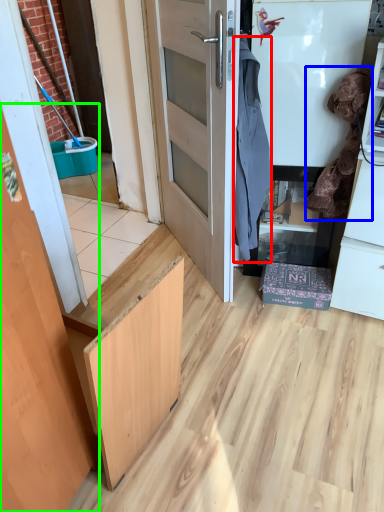
Question: Based on their relative distances, which object is farther from laundry (highlighted by a red box)? Choose from laundry (highlighted by a blue box) and door (highlighted by a green box).

Choices:
 (A) laundry
 (B) door

Answer: (B)